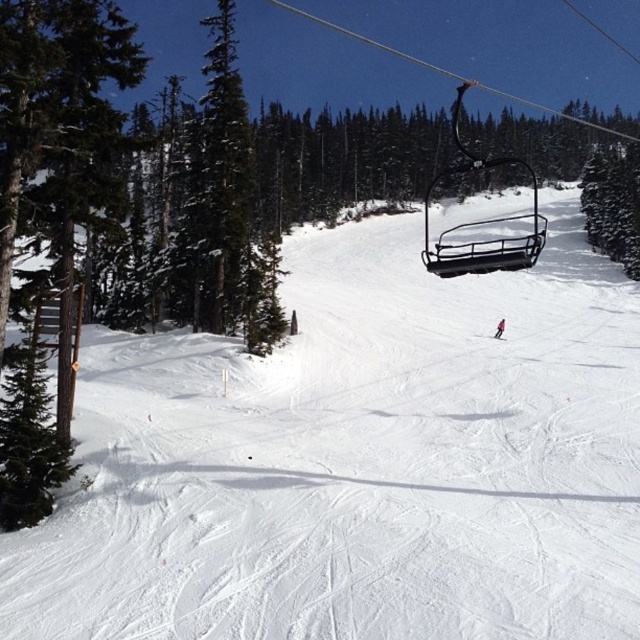
Question: Where is black metal ski lift at upper center located in relation to pink fabric skier at center in the image?

Choices:
 (A) below
 (B) above

Answer: (B)

Question: Estimate the real-world distances between objects in this image. Which object is farther from the pink fabric skier at center?

Choices:
 (A) white snow ski slope at center
 (B) pink matte ski at center

Answer: (A)

Question: Which object is closer to the camera taking this photo?

Choices:
 (A) pink matte ski at center
 (B) white matte ski at center
 (C) white snow ski slope at center

Answer: (C)

Question: Based on their relative distances, which object is nearer to the white snow ski slope at center?

Choices:
 (A) white matte ski at center
 (B) pink matte ski at center
 (C) pink fabric skier at center

Answer: (B)

Question: Does white snow ski slope at center appear on the right side of pink matte ski at center?

Choices:
 (A) no
 (B) yes

Answer: (A)

Question: Where is green snow-covered tree at right located in relation to pink fabric skier at center in the image?

Choices:
 (A) left
 (B) right

Answer: (B)